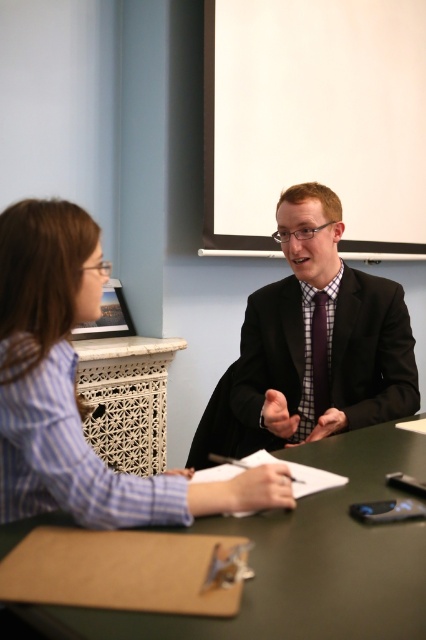
Which of these two, blue striped shirt at left or matte black suit at center, stands shorter?

blue striped shirt at left is shorter.

Who is positioned more to the left, blue striped shirt at left or matte black suit at center?

Positioned to the left is blue striped shirt at left.

Image resolution: width=426 pixels, height=640 pixels. Identify the location of blue striped shirt at left. (74, 388).

From the picture: Can you confirm if blue striped shirt at left is smaller than purple satin tie at center?

Actually, blue striped shirt at left might be larger than purple satin tie at center.

Which is behind, point (37, 502) or point (313, 337)?

Positioned behind is point (313, 337).

Identify the location of blue striped shirt at left. (74, 388).

Which of these two, green matte table at center or matte black suit at center, stands shorter?

green matte table at center is shorter.

Does green matte table at center appear under matte black suit at center?

Correct, green matte table at center is located below matte black suit at center.

Find the location of a particular element. The image size is (426, 640). green matte table at center is located at coordinates (301, 561).